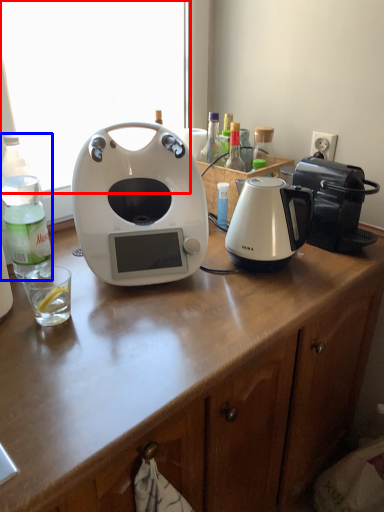
Question: Which point is further to the camera, window screen (highlighted by a red box) or bottle (highlighted by a blue box)?

Choices:
 (A) window screen
 (B) bottle

Answer: (A)